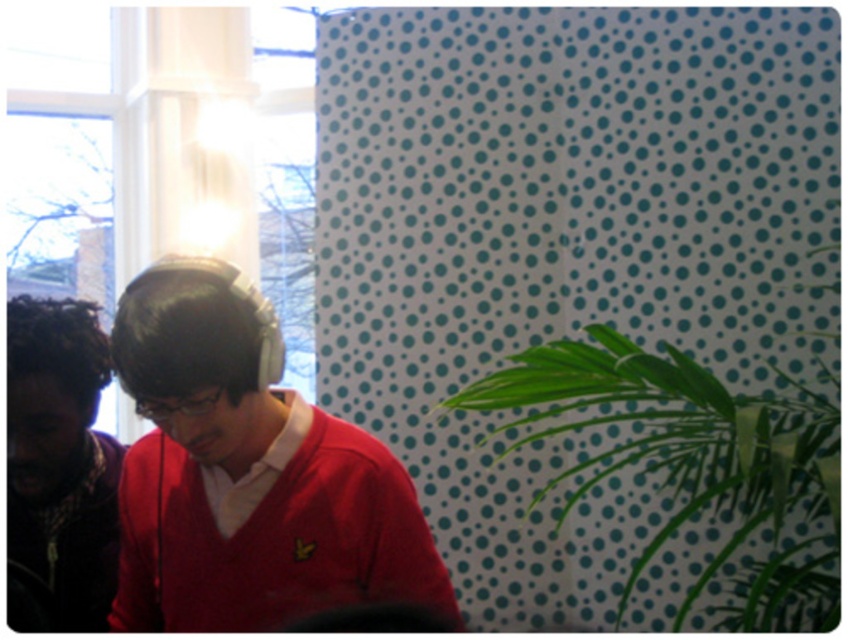
Based on the photo, is matte red sweater at center bigger than green leafy plant at right?

Actually, matte red sweater at center might be smaller than green leafy plant at right.

Is matte red sweater at center shorter than green leafy plant at right?

Yes, matte red sweater at center is shorter than green leafy plant at right.

Is point (173, 291) farther from camera compared to point (742, 449)?

No, it is not.

Find the location of a particular element. The height and width of the screenshot is (640, 848). matte red sweater at center is located at coordinates (247, 474).

Can you confirm if matte red sweater at center is shorter than dark brown curly hair at left?

In fact, matte red sweater at center may be taller than dark brown curly hair at left.

Can you confirm if matte red sweater at center is thinner than dark brown curly hair at left?

In fact, matte red sweater at center might be wider than dark brown curly hair at left.

Between point (341, 580) and point (32, 305), which one is positioned behind?

Point (32, 305)

The image size is (848, 640). Find the location of `matte red sweater at center`. matte red sweater at center is located at coordinates (247, 474).

Measure the distance between point (667, 404) and camera.

The distance of point (667, 404) from camera is 2.24 meters.

Does green leafy plant at right appear under dark brown curly hair at left?

No, green leafy plant at right is not below dark brown curly hair at left.

Is point (503, 429) farther from viewer compared to point (28, 364)?

Yes, it is.

At what (x,y) coordinates should I click in order to perform the action: click on green leafy plant at right. Please return your answer as a coordinate pair (x, y). The height and width of the screenshot is (640, 848). Looking at the image, I should click on (695, 461).